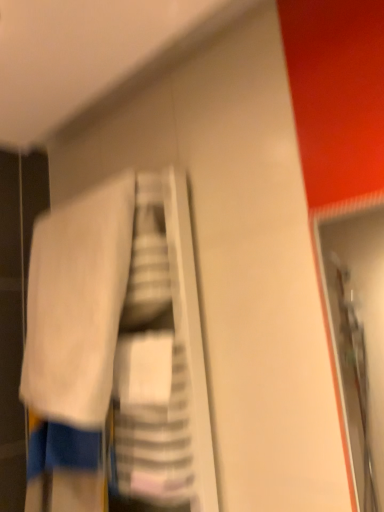
Question: Would you say white fabric at center is inside or outside white soft towel at upper left?

Choices:
 (A) outside
 (B) inside

Answer: (A)

Question: From the image's perspective, is white fabric at center located above or below white soft towel at upper left?

Choices:
 (A) above
 (B) below

Answer: (B)

Question: Would you say white fabric at center is to the left or to the right of white soft towel at upper left in the picture?

Choices:
 (A) left
 (B) right

Answer: (B)

Question: From a real-world perspective, is white soft towel at upper left positioned above or below white fabric at center?

Choices:
 (A) below
 (B) above

Answer: (B)

Question: In terms of width, does white soft towel at upper left look wider or thinner when compared to white fabric at center?

Choices:
 (A) wide
 (B) thin

Answer: (B)

Question: Considering the positions of point (81, 200) and point (132, 346), is point (81, 200) closer or farther from the camera than point (132, 346)?

Choices:
 (A) farther
 (B) closer

Answer: (A)

Question: In the image, is white soft towel at upper left positioned in front of or behind white fabric at center?

Choices:
 (A) front
 (B) behind

Answer: (B)